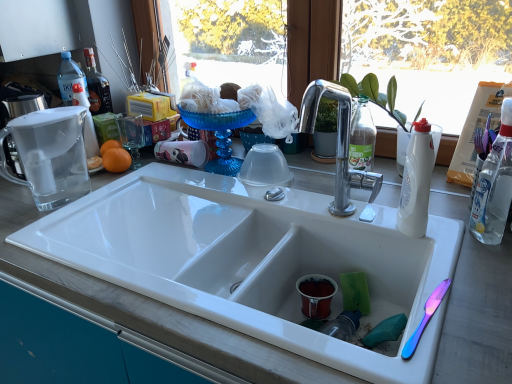
Locate an element on the screen. The image size is (512, 384). vacant space that is in between white plastic bottle at right, the second bottle when ordered from right to left, and clear glass pitcher at upper left is located at coordinates (186, 212).